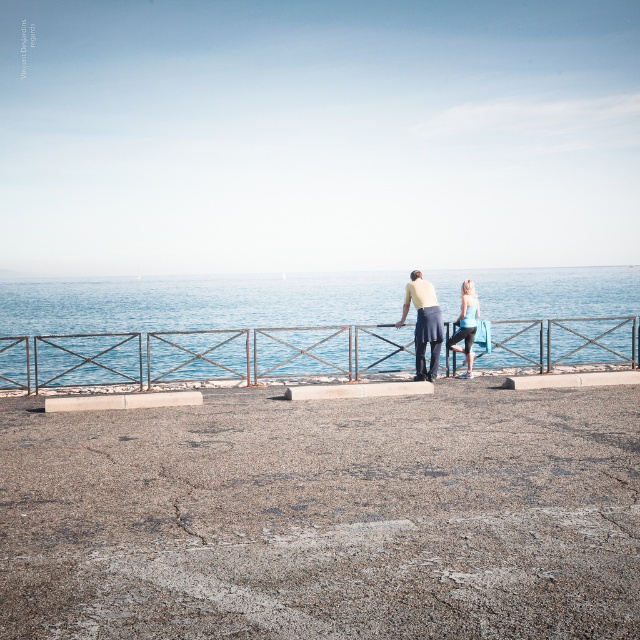
You are a photographer standing at the edge of the walkway. You want to capture a photo of the blue fabric leggings at center without including the smooth concrete ground at center in the frame. Is the distance between them sufficient to allow you to zoom in closely on the leggings while excluding the ground?

The smooth concrete ground at center is 7.48 meters away from the blue fabric leggings at center. Since the distance is relatively large, zooming in on the blue fabric leggings at center should allow the photographer to exclude the smooth concrete ground at center from the frame.

You are standing on the walkway and want to look down at both the smooth concrete ground at center and the blue water at center. Which one will appear closer to you?

The smooth concrete ground at center is closer to the viewer than the blue water at center, so it will appear closer when looking down.

You are a photographer positioned behind the two people on the walkway. You want to take a photo that includes both the matte yellow shirt at center and the blue fabric leggings at center. Which object should you focus on first to ensure both are in sharp focus?

The matte yellow shirt at center is closer to the viewer than the blue fabric leggings at center, so you should focus on the matte yellow shirt at center first to ensure both are in sharp focus.